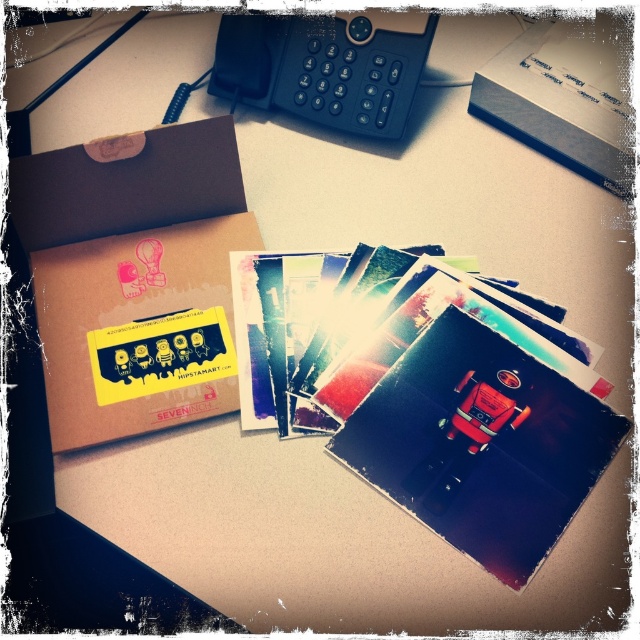
Is black plastic phone at upper center further to camera compared to white cardboard box at upper center?

Yes, black plastic phone at upper center is further from the viewer.

Describe the element at coordinates (321, 68) in the screenshot. I see `black plastic phone at upper center` at that location.

Where is `black plastic phone at upper center`? The image size is (640, 640). black plastic phone at upper center is located at coordinates coord(321,68).

Can you confirm if brown cardboard box at upper left is smaller than white cardboard box at upper center?

Actually, brown cardboard box at upper left might be larger than white cardboard box at upper center.

Measure the distance between brown cardboard box at upper left and camera.

brown cardboard box at upper left is 21.52 inches from camera.

Does point (120, 429) come behind point (525, 80)?

No, it is not.

Image resolution: width=640 pixels, height=640 pixels. Find the location of `brown cardboard box at upper left`. brown cardboard box at upper left is located at coordinates (129, 266).

Is point (112, 413) closer to viewer compared to point (369, 129)?

That is True.

Is brown cardboard box at upper left thinner than black plastic phone at upper center?

Yes, brown cardboard box at upper left is thinner than black plastic phone at upper center.

Is point (116, 212) farther from camera compared to point (401, 104)?

No, (116, 212) is in front of (401, 104).

The height and width of the screenshot is (640, 640). I want to click on brown cardboard box at upper left, so click(x=129, y=266).